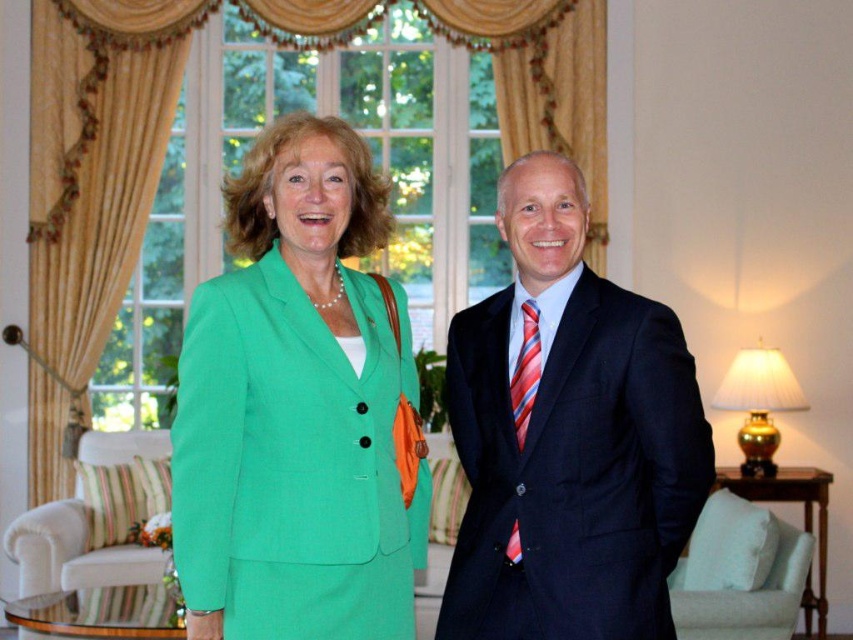
Can you confirm if green fabric suit at center is wider than striped fabric tie at center?

Indeed, green fabric suit at center has a greater width compared to striped fabric tie at center.

Does point (285, 572) come in front of point (518, 387)?

Yes, point (285, 572) is closer to viewer.

Image resolution: width=853 pixels, height=640 pixels. I want to click on green fabric suit at center, so click(294, 410).

Is green fabric suit at center further to the viewer compared to green fabric suit at left?

That is True.

Between point (250, 296) and point (347, 467), which one is positioned in front?

Point (347, 467) is more forward.

The width and height of the screenshot is (853, 640). What are the coordinates of `green fabric suit at center` in the screenshot? It's located at (294, 410).

Consider the image. Is green fabric suit at left below navy blue suit at center?

Incorrect, green fabric suit at left is not positioned below navy blue suit at center.

Who is lower down, green fabric suit at left or navy blue suit at center?

navy blue suit at center is below.

Is point (256, 424) more distant than point (635, 547)?

No, (256, 424) is in front of (635, 547).

Image resolution: width=853 pixels, height=640 pixels. In order to click on green fabric suit at left in this screenshot , I will do `click(296, 408)`.